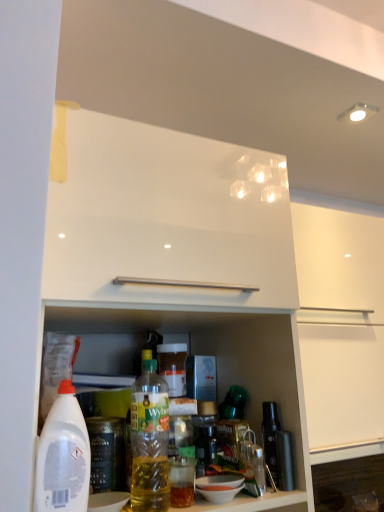
In order to click on translucent plastic bottle at center, placed as the second bottle when sorted from left to right in this screenshot , I will do `click(149, 440)`.

What do you see at coordinates (149, 440) in the screenshot? I see `translucent plastic bottle at center, positioned as the first bottle in right-to-left order` at bounding box center [149, 440].

Looking at this image, what is the approximate width of translucent plastic bottle at center, positioned as the first bottle in right-to-left order?

It is 14.77 centimeters.

Measure the distance between white plastic bottle at lower left, which ranks as the first bottle in left-to-right order, and camera.

white plastic bottle at lower left, which ranks as the first bottle in left-to-right order, is 26.95 inches away from camera.

Consider the image. What is the approximate width of white plastic bottle at lower left, the second bottle positioned from the right?

7.59 centimeters.

I want to click on white plastic bottle at lower left, which ranks as the first bottle in left-to-right order, so click(x=63, y=456).

How much space does white plastic bottle at lower left, the second bottle positioned from the right, occupy vertically?

It is 11.08 inches.

Describe the element at coordinates (63, 456) in the screenshot. I see `white plastic bottle at lower left, the second bottle positioned from the right` at that location.

You are a GUI agent. You are given a task and a screenshot of the screen. Output one action in this format:
    pyautogui.click(x=<x>, y=<y>)
    Task: Click on the translucent plastic bottle at center, placed as the second bottle when sorted from left to right
    
    Given the screenshot: What is the action you would take?
    pyautogui.click(x=149, y=440)

Considering the positions of objects translucent plastic bottle at center, positioned as the first bottle in right-to-left order, and white plastic bottle at lower left, which ranks as the first bottle in left-to-right order, in the image provided, who is more to the right, translucent plastic bottle at center, positioned as the first bottle in right-to-left order, or white plastic bottle at lower left, which ranks as the first bottle in left-to-right order,?

translucent plastic bottle at center, positioned as the first bottle in right-to-left order, is more to the right.

Considering the positions of objects translucent plastic bottle at center, positioned as the first bottle in right-to-left order, and white plastic bottle at lower left, which ranks as the first bottle in left-to-right order, in the image provided, who is behind, translucent plastic bottle at center, positioned as the first bottle in right-to-left order, or white plastic bottle at lower left, which ranks as the first bottle in left-to-right order,?

translucent plastic bottle at center, positioned as the first bottle in right-to-left order, is further from the camera.

Is point (155, 406) closer to camera compared to point (48, 487)?

No, it is not.

From the image's perspective, which object appears higher, translucent plastic bottle at center, placed as the second bottle when sorted from left to right, or white plastic bottle at lower left, the second bottle positioned from the right?

white plastic bottle at lower left, the second bottle positioned from the right, from the image's perspective.

From a real-world perspective, which is physically below, translucent plastic bottle at center, placed as the second bottle when sorted from left to right, or white plastic bottle at lower left, the second bottle positioned from the right?

From a 3D spatial view, white plastic bottle at lower left, the second bottle positioned from the right, is below.

Does translucent plastic bottle at center, placed as the second bottle when sorted from left to right, have a lesser width compared to white plastic bottle at lower left, which ranks as the first bottle in left-to-right order?

No.

Between translucent plastic bottle at center, placed as the second bottle when sorted from left to right, and white plastic bottle at lower left, the second bottle positioned from the right, which one has less height?

With less height is white plastic bottle at lower left, the second bottle positioned from the right.

Considering the relative sizes of translucent plastic bottle at center, placed as the second bottle when sorted from left to right, and white plastic bottle at lower left, the second bottle positioned from the right, in the image provided, is translucent plastic bottle at center, placed as the second bottle when sorted from left to right, smaller than white plastic bottle at lower left, the second bottle positioned from the right,?

No, translucent plastic bottle at center, placed as the second bottle when sorted from left to right, is not smaller than white plastic bottle at lower left, the second bottle positioned from the right.

Is translucent plastic bottle at center, placed as the second bottle when sorted from left to right, not inside white plastic bottle at lower left, the second bottle positioned from the right?

Yes, translucent plastic bottle at center, placed as the second bottle when sorted from left to right, is located beyond the bounds of white plastic bottle at lower left, the second bottle positioned from the right.

Can you see translucent plastic bottle at center, placed as the second bottle when sorted from left to right, touching white plastic bottle at lower left, the second bottle positioned from the right?

No, translucent plastic bottle at center, placed as the second bottle when sorted from left to right, is not with white plastic bottle at lower left, the second bottle positioned from the right.

Is translucent plastic bottle at center, placed as the second bottle when sorted from left to right, turned away from white plastic bottle at lower left, the second bottle positioned from the right?

translucent plastic bottle at center, placed as the second bottle when sorted from left to right, does not have its back to white plastic bottle at lower left, the second bottle positioned from the right.

You are a GUI agent. You are given a task and a screenshot of the screen. Output one action in this format:
    pyautogui.click(x=<x>, y=<y>)
    Task: Click on the bottle below the translucent plastic bottle at center, placed as the second bottle when sorted from left to right (from a real-world perspective)
    
    Given the screenshot: What is the action you would take?
    click(63, 456)

Is white plastic bottle at lower left, which ranks as the first bottle in left-to-right order, to the right of translucent plastic bottle at center, placed as the second bottle when sorted from left to right, from the viewer's perspective?

Incorrect, white plastic bottle at lower left, which ranks as the first bottle in left-to-right order, is not on the right side of translucent plastic bottle at center, placed as the second bottle when sorted from left to right.

Does white plastic bottle at lower left, which ranks as the first bottle in left-to-right order, come behind translucent plastic bottle at center, placed as the second bottle when sorted from left to right?

No, it is not.

Consider the image. Which is further, (72, 412) or (155, 428)?

The point (155, 428) is more distant.

From the image's perspective, is white plastic bottle at lower left, which ranks as the first bottle in left-to-right order, on top of translucent plastic bottle at center, placed as the second bottle when sorted from left to right?

Indeed, from the image's perspective, white plastic bottle at lower left, which ranks as the first bottle in left-to-right order, is shown above translucent plastic bottle at center, placed as the second bottle when sorted from left to right.

From a real-world perspective, is white plastic bottle at lower left, the second bottle positioned from the right, above or below translucent plastic bottle at center, positioned as the first bottle in right-to-left order?

From a real-world perspective, white plastic bottle at lower left, the second bottle positioned from the right, is physically below translucent plastic bottle at center, positioned as the first bottle in right-to-left order.

Considering the relative sizes of white plastic bottle at lower left, the second bottle positioned from the right, and translucent plastic bottle at center, placed as the second bottle when sorted from left to right, in the image provided, is white plastic bottle at lower left, the second bottle positioned from the right, thinner than translucent plastic bottle at center, placed as the second bottle when sorted from left to right,?

Correct, the width of white plastic bottle at lower left, the second bottle positioned from the right, is less than that of translucent plastic bottle at center, placed as the second bottle when sorted from left to right.

Can you confirm if white plastic bottle at lower left, the second bottle positioned from the right, is taller than translucent plastic bottle at center, positioned as the first bottle in right-to-left order?

No, white plastic bottle at lower left, the second bottle positioned from the right, is not taller than translucent plastic bottle at center, positioned as the first bottle in right-to-left order.

Considering the relative sizes of white plastic bottle at lower left, the second bottle positioned from the right, and translucent plastic bottle at center, placed as the second bottle when sorted from left to right, in the image provided, is white plastic bottle at lower left, the second bottle positioned from the right, smaller than translucent plastic bottle at center, placed as the second bottle when sorted from left to right,?

Correct, white plastic bottle at lower left, the second bottle positioned from the right, occupies less space than translucent plastic bottle at center, placed as the second bottle when sorted from left to right.

Looking at this image, would you say translucent plastic bottle at center, positioned as the first bottle in right-to-left order, is part of white plastic bottle at lower left, the second bottle positioned from the right,'s contents?

No.

Are white plastic bottle at lower left, the second bottle positioned from the right, and translucent plastic bottle at center, positioned as the first bottle in right-to-left order, located far from each other?

white plastic bottle at lower left, the second bottle positioned from the right, is near translucent plastic bottle at center, positioned as the first bottle in right-to-left order, not far away.

Is white plastic bottle at lower left, which ranks as the first bottle in left-to-right order, aimed at translucent plastic bottle at center, positioned as the first bottle in right-to-left order?

No, white plastic bottle at lower left, which ranks as the first bottle in left-to-right order, is not turned towards translucent plastic bottle at center, positioned as the first bottle in right-to-left order.

How different are the orientations of white plastic bottle at lower left, the second bottle positioned from the right, and translucent plastic bottle at center, positioned as the first bottle in right-to-left order, in degrees?

The angle between the facing direction of white plastic bottle at lower left, the second bottle positioned from the right, and the facing direction of translucent plastic bottle at center, positioned as the first bottle in right-to-left order, is 0.00239 degrees.

At what (x,y) coordinates should I click in order to perform the action: click on bottle on the left of translucent plastic bottle at center, placed as the second bottle when sorted from left to right. Please return your answer as a coordinate pair (x, y). The width and height of the screenshot is (384, 512). Looking at the image, I should click on (63, 456).

The image size is (384, 512). I want to click on bottle below the translucent plastic bottle at center, positioned as the first bottle in right-to-left order (from a real-world perspective), so click(x=63, y=456).

This screenshot has height=512, width=384. I want to click on bottle to the left of translucent plastic bottle at center, placed as the second bottle when sorted from left to right, so click(x=63, y=456).